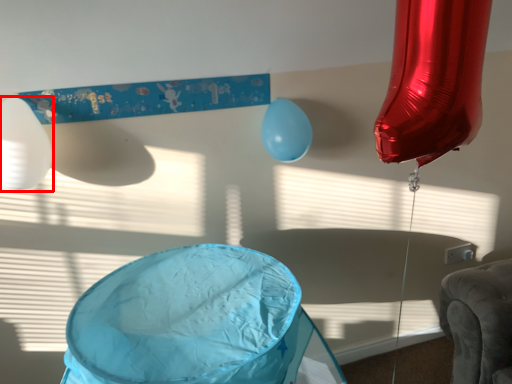
Question: From the image's perspective, what is the correct spatial positioning of balloon (annotated by the red box) in reference to balloon?

Choices:
 (A) above
 (B) below

Answer: (B)